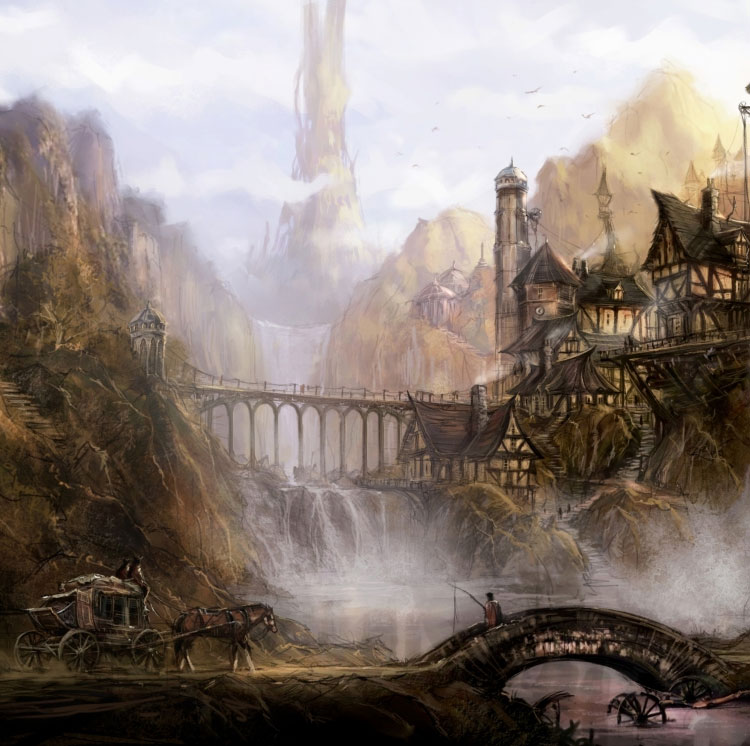
Locate an element on the screen. The height and width of the screenshot is (746, 750). art work is located at coordinates (508, 477).